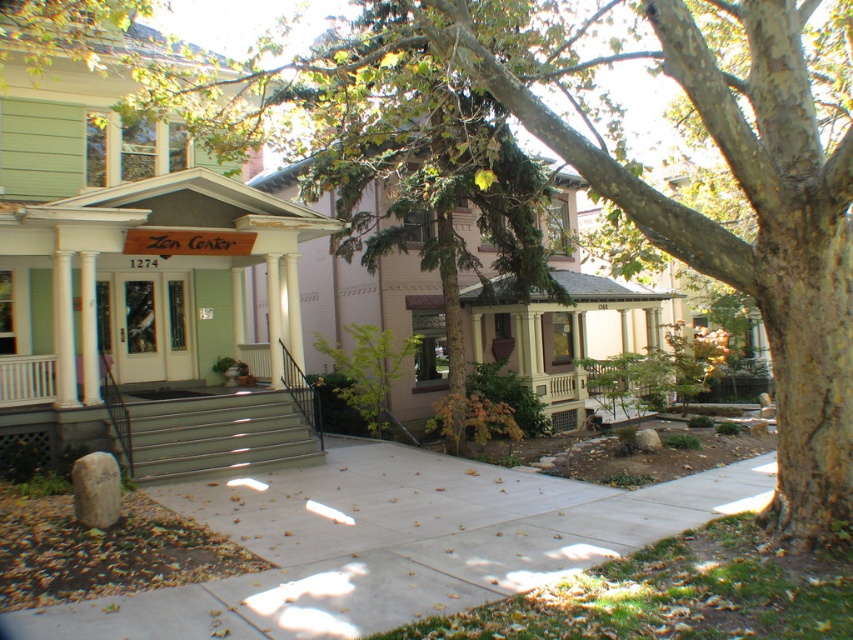
Question: Where is concrete at center located in relation to metallic gray steps at center in the image?

Choices:
 (A) below
 (B) above

Answer: (A)

Question: Is concrete at center bigger than metallic gray steps at center?

Choices:
 (A) yes
 (B) no

Answer: (B)

Question: Which of the following is the farthest from the observer?

Choices:
 (A) (244, 444)
 (B) (310, 493)

Answer: (A)

Question: Among these points, which one is nearest to the camera?

Choices:
 (A) (268, 435)
 (B) (465, 476)

Answer: (B)

Question: Which of the following is the closest to the observer?

Choices:
 (A) metallic gray steps at center
 (B) concrete at center

Answer: (B)

Question: Is concrete at center closer to the viewer compared to metallic gray steps at center?

Choices:
 (A) no
 (B) yes

Answer: (B)